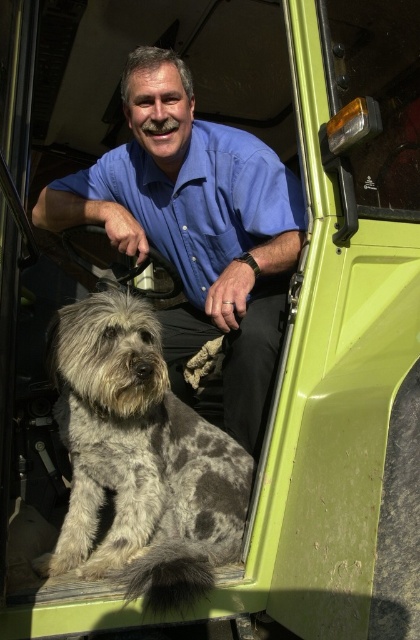
Question: Which is nearer to the gray speckled fur dog at center?

Choices:
 (A) blue cotton shirt at upper center
 (B) blue cotton shirt at center

Answer: (B)

Question: Which of the following is the farthest from the observer?

Choices:
 (A) (147, 346)
 (B) (160, 177)

Answer: (B)

Question: Is gray speckled fur dog at center closer to camera compared to blue cotton shirt at upper center?

Choices:
 (A) no
 (B) yes

Answer: (B)

Question: Does gray speckled fur dog at center have a larger size compared to blue cotton shirt at upper center?

Choices:
 (A) no
 (B) yes

Answer: (A)

Question: Which object is farther from the camera taking this photo?

Choices:
 (A) blue cotton shirt at center
 (B) gray speckled fur dog at center
 (C) blue cotton shirt at upper center

Answer: (C)

Question: Does blue cotton shirt at center have a greater width compared to gray speckled fur dog at center?

Choices:
 (A) no
 (B) yes

Answer: (B)